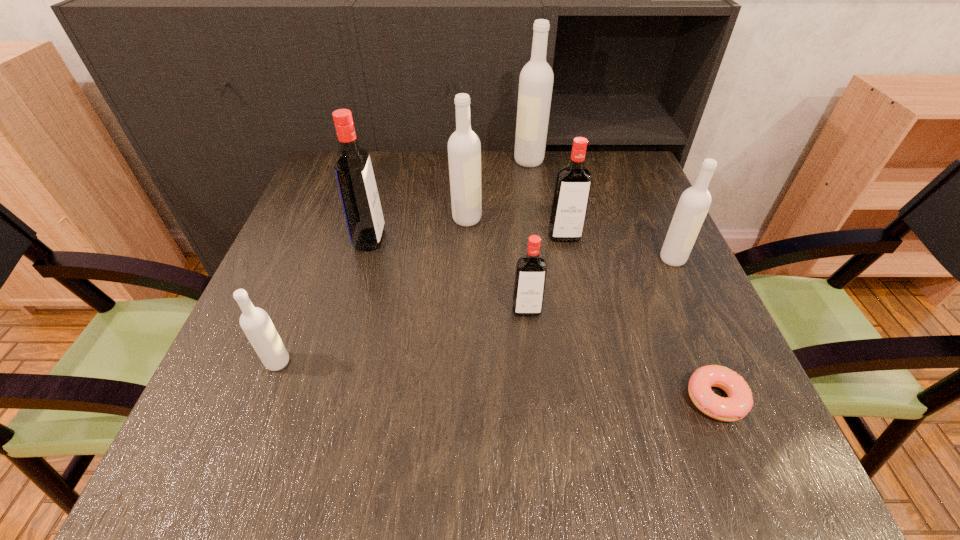
Identify which object is located as the nearest to the farthest object. Please provide its 2D coordinates. Your answer should be formatted as a tuple, i.e. [(x, y)], where the tuple contains the x and y coordinates of a point satisfying the conditions above.

[(464, 148)]

Identify the location of vodka that can be found as the fourth closest to the nearest object. (464, 148).

Choose which vodka is the fourth nearest neighbor to the nearest white vodka. Please provide its 2D coordinates. Your answer should be formatted as a tuple, i.e. [(x, y)], where the tuple contains the x and y coordinates of a point satisfying the conditions above.

[(573, 183)]

Identify the location of white vodka that is the closest to the leftmost vodka. Image resolution: width=960 pixels, height=540 pixels. tap(464, 148).

Choose which white vodka is the second nearest neighbor to the sixth object from right to left. Please provide its 2D coordinates. Your answer should be formatted as a tuple, i.e. [(x, y)], where the tuple contains the x and y coordinates of a point satisfying the conditions above.

[(694, 203)]

Select which red vodka appears as the second closest to the third white vodka from right to left. Please provide its 2D coordinates. Your answer should be formatted as a tuple, i.e. [(x, y)], where the tuple contains the x and y coordinates of a point satisfying the conditions above.

[(573, 183)]

Find the location of a particular element. This screenshot has width=960, height=540. the second closest red vodka to the nearest vodka is located at coordinates (531, 269).

You are a GUI agent. You are given a task and a screenshot of the screen. Output one action in this format:
    pyautogui.click(x=<x>, y=<y>)
    Task: Click on the vacant space that satisfies the following two spatial constraints: 1. on the front and back of the second vodka from left to right; 2. on the right side of the shortest object
    The height and width of the screenshot is (540, 960).
    Given the screenshot: What is the action you would take?
    pyautogui.click(x=326, y=398)

Identify the location of vacant space that satisfies the following two spatial constraints: 1. on the back side of the third vodka from left to right; 2. on the left side of the tallest vodka. (468, 161).

This screenshot has height=540, width=960. Find the location of `free spot that satisfies the following two spatial constraints: 1. on the front side of the fifth vodka from right to left; 2. on the left side of the nearest object`. free spot that satisfies the following two spatial constraints: 1. on the front side of the fifth vodka from right to left; 2. on the left side of the nearest object is located at coordinates 461,398.